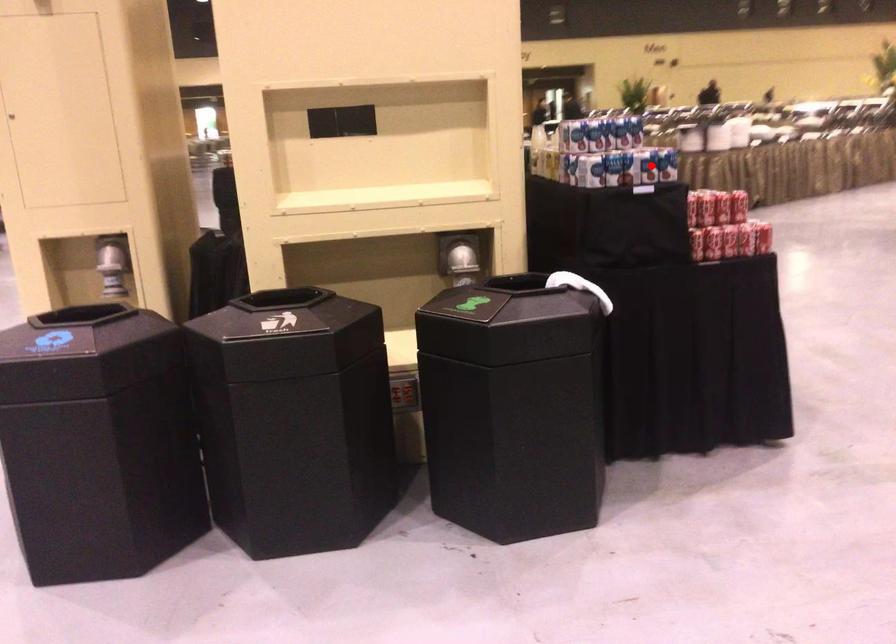
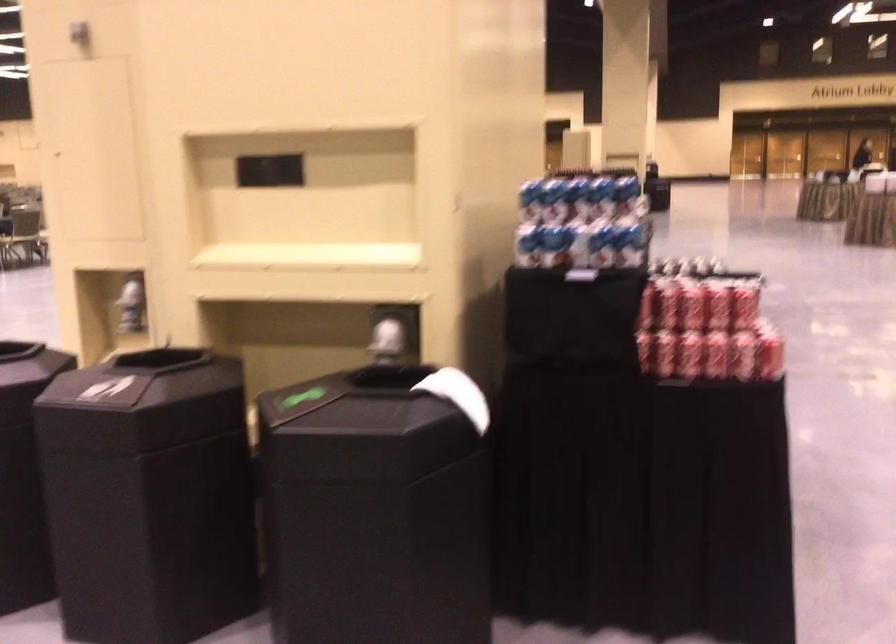
The point at the highlighted location is marked in the first image. Where is the corresponding point in the second image?

(600, 245)